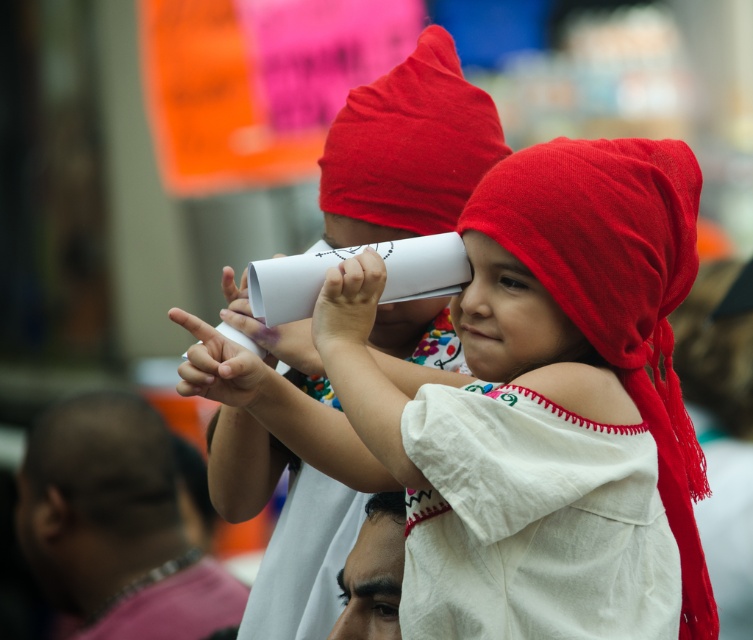
You are a photographer trying to capture the perfect shot of the red cotton headdress at center. Given its position at coordinates, where should you aim your camera to ensure it is centered in your viewfinder?

To center the red cotton headdress at center in your viewfinder, aim your camera precisely at the coordinates provided, which are point (617, 289).

You are a photographer trying to capture a clear photo of the bald skin at lower left and the white fabric head at center. Which object should you focus on first to ensure both are in focus?

The white fabric head at center is behind bald skin at lower left, so you should focus on the bald skin at lower left first to ensure both are in focus.

You are a photographer trying to capture a clear shot of the red cotton headdress at center and the white soft fabric shoulder at center. Since the children are moving, you need to focus on the one that is closer to the left side. Which object should you focus on?

The white soft fabric shoulder at center is to the left of the red cotton headdress at center, so you should focus on the white soft fabric shoulder at center to capture the leftmost object.